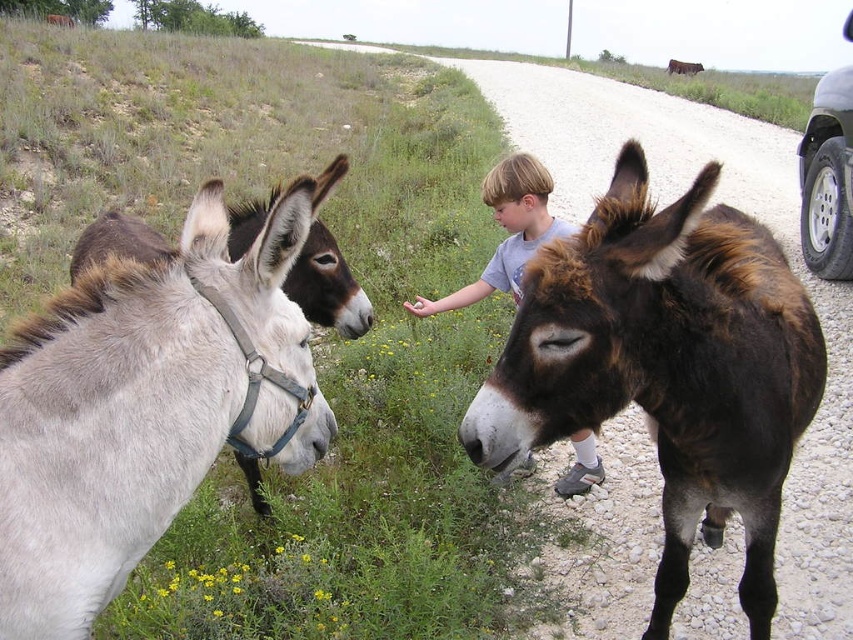
You are a photographer trying to capture a photo of the gray soft fur mule at left and the brown fuzzy mule at right. If you want to include both mules in the frame, which mule should you position closer to the camera to ensure both are fully visible?

The gray soft fur mule at left is located below the brown fuzzy mule at right, so positioning the gray soft fur mule at left closer to the camera will ensure both are fully visible in the frame.